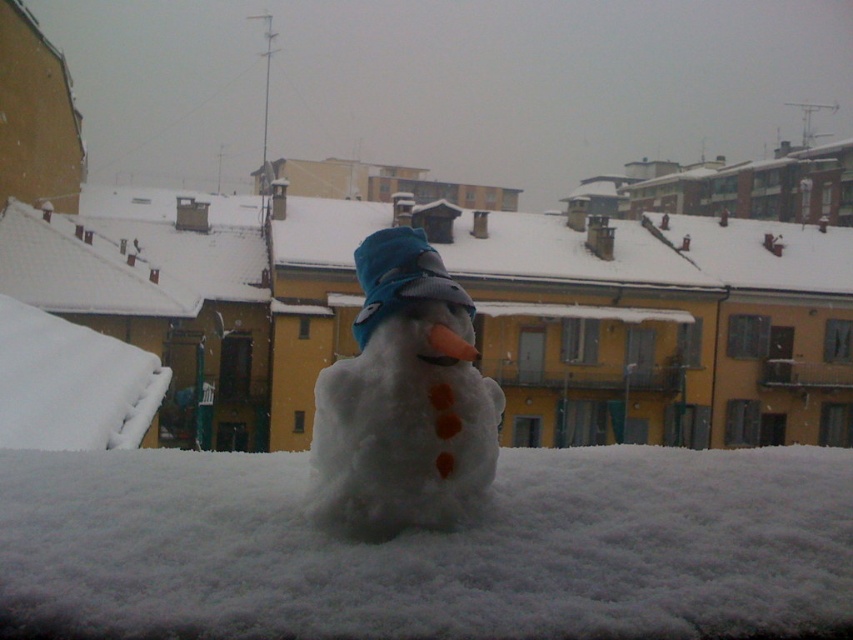
You are a delivery robot with a 32.40 inch wide package. You need to deliver it to the white fluffy snowman at center. Can you move through the white fluffy snow at center to reach it?

The white fluffy snow at center is 32.40 inches away from the white fluffy snowman at center. Since your package is 32.40 inches wide, you can just barely move through the white fluffy snow at center to reach the white fluffy snowman at center as the distance matches the package width.

You are standing in the snowy urban scene and want to place a small flag at the point that is closer to you. Which point should you choose between point (160, 609) and point (486, 410)?

Point (160, 609) is closer to the viewer than point (486, 410), so you should choose point (160, 609) to place the small flag.

You are a delivery robot that needs to navigate through the snowy area. The path you need to take goes from the left side of the white fluffy snow at center to the right side of the white fluffy snowman at center. Can you safely pass through this path if your width is 1.2 meters?

The white fluffy snow at center might be wider than white fluffy snowman at center, so the path between them could be wide enough for the delivery robot to pass safely if the snow is indeed wider. However, without exact measurements, it is uncertain. The robot should proceed with caution.